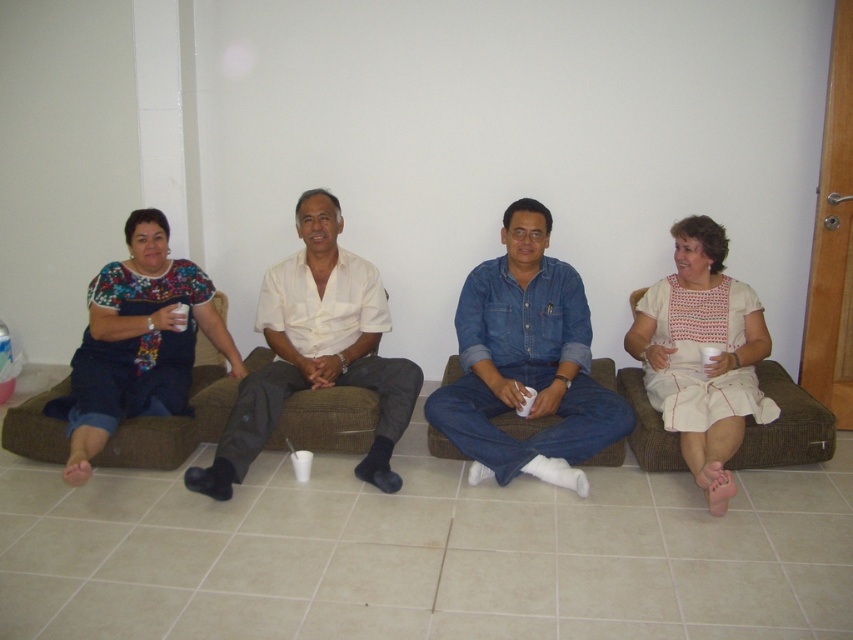
Consider the image. You are a photographer setting up a tripod to take a group photo of the denim shirt at center and the brown fabric couch at center. The tripod can only accommodate objects up to 1.2 meters in height. Based on their heights, will both subjects fit within the tripod height limit?

The denim shirt at center is much taller than the brown fabric couch at center. Since the tripod can only accommodate up to 1.2 meters, if the denim shirt at center exceeds this height, it might not fit. However, the description only states their relative heights, not absolute measurements. Without specific heights, we cannot definitively confirm if both will fit within the limit.